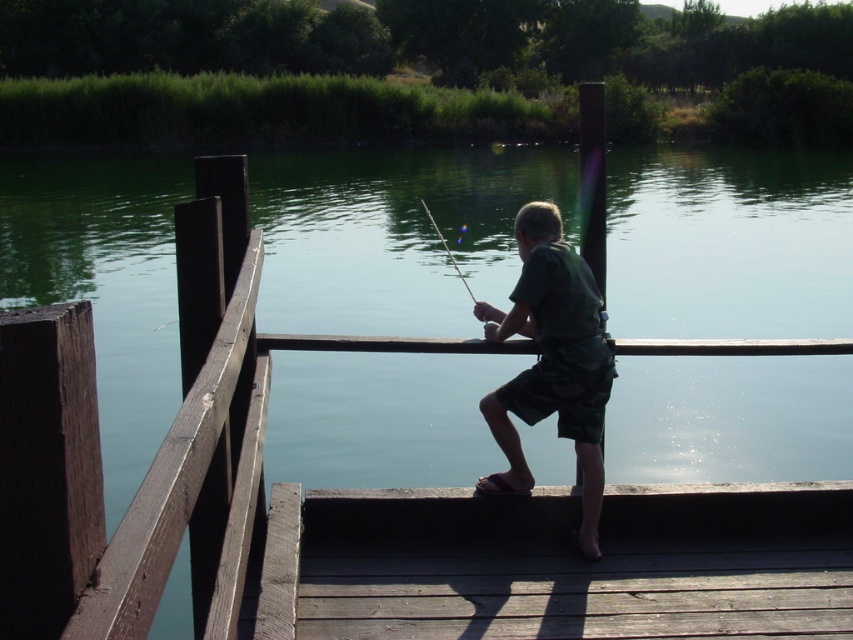
You are a photographer aiming to capture the boy fishing. You notice the green matte shirt at center and the smooth black rod at center. Which object should you focus on if you want to photograph the taller one?

The smooth black rod at center is taller than the green matte shirt at center, so you should focus on the smooth black rod at center to photograph the taller one.

You are standing at the center of the image and want to move to the brown wooden dock at lower center. Which direction should you head towards?

The brown wooden dock at lower center is located at point (560, 563), so you should head towards the lower center direction to reach it.